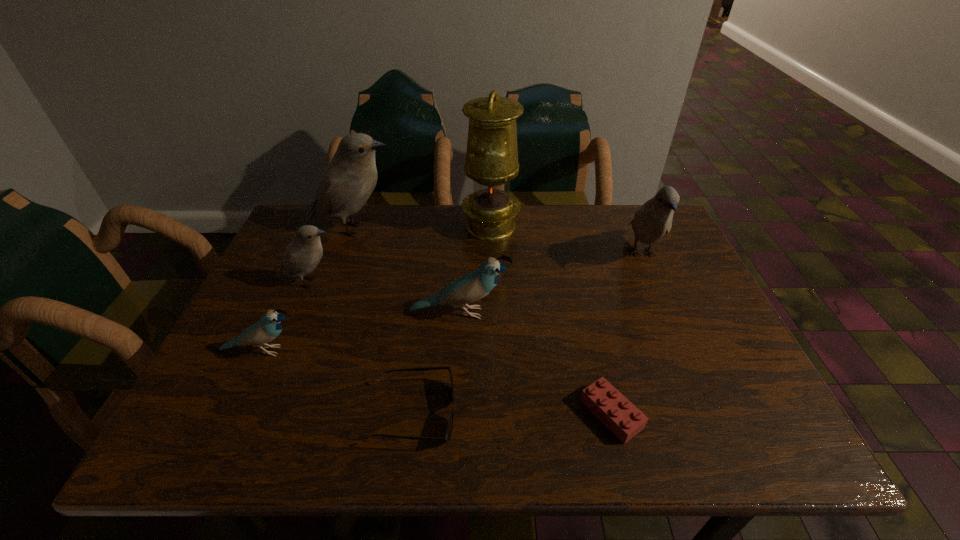
Locate an element on the screen. This screenshot has height=540, width=960. the tallest object is located at coordinates (492, 154).

Locate an element on the screen. the biggest white bird is located at coordinates (348, 181).

The width and height of the screenshot is (960, 540). I want to click on the tallest bird, so click(x=348, y=181).

You are a GUI agent. You are given a task and a screenshot of the screen. Output one action in this format:
    pyautogui.click(x=<x>, y=<y>)
    Task: Click on the fourth shortest bird
    Image resolution: width=960 pixels, height=540 pixels.
    Given the screenshot: What is the action you would take?
    pyautogui.click(x=654, y=219)

I want to click on the rightmost white bird, so click(654, 219).

I want to click on the smallest white bird, so click(x=302, y=255).

Where is `the farther blue bird`? This screenshot has height=540, width=960. the farther blue bird is located at coordinates (473, 286).

I want to click on the fifth farthest object, so click(473, 286).

Where is `the left blue bird`? the left blue bird is located at coordinates (268, 328).

You are a GUI agent. You are given a task and a screenshot of the screen. Output one action in this format:
    pyautogui.click(x=<x>, y=<y>)
    Task: Click on the third shortest object
    
    Given the screenshot: What is the action you would take?
    pyautogui.click(x=268, y=328)